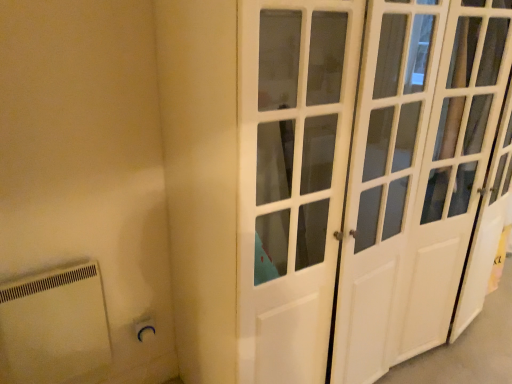
Question: From the image's perspective, is white plastic electric outlet at lower left over white glossy door at center?

Choices:
 (A) no
 (B) yes

Answer: (A)

Question: Are white plastic electric outlet at lower left and white glossy door at center located far from each other?

Choices:
 (A) no
 (B) yes

Answer: (A)

Question: Is white plastic electric outlet at lower left aimed at white glossy door at center?

Choices:
 (A) no
 (B) yes

Answer: (A)

Question: From a real-world perspective, is white plastic electric outlet at lower left below white glossy door at center?

Choices:
 (A) no
 (B) yes

Answer: (B)

Question: Can you confirm if white plastic electric outlet at lower left is thinner than white glossy door at center?

Choices:
 (A) yes
 (B) no

Answer: (A)

Question: Is point (140, 327) positioned closer to the camera than point (23, 362)?

Choices:
 (A) farther
 (B) closer

Answer: (A)

Question: Relative to white plastic radiator at lower left, is white plastic electric outlet at lower left in front or behind?

Choices:
 (A) front
 (B) behind

Answer: (B)

Question: Do you think white plastic electric outlet at lower left is within white plastic radiator at lower left, or outside of it?

Choices:
 (A) outside
 (B) inside

Answer: (B)

Question: From the image's perspective, is white plastic electric outlet at lower left above or below white plastic radiator at lower left?

Choices:
 (A) above
 (B) below

Answer: (A)

Question: In terms of width, does white plastic radiator at lower left look wider or thinner when compared to white plastic electric outlet at lower left?

Choices:
 (A) wide
 (B) thin

Answer: (A)

Question: Relative to white plastic electric outlet at lower left, is white plastic radiator at lower left in front or behind?

Choices:
 (A) front
 (B) behind

Answer: (A)

Question: From a real-world perspective, is white plastic radiator at lower left physically located above or below white plastic electric outlet at lower left?

Choices:
 (A) above
 (B) below

Answer: (A)

Question: Considering the relative positions of white plastic radiator at lower left and white plastic electric outlet at lower left in the image provided, is white plastic radiator at lower left to the left or to the right of white plastic electric outlet at lower left?

Choices:
 (A) right
 (B) left

Answer: (B)

Question: Is white plastic electric outlet at lower left to the left or to the right of white glossy door at center in the image?

Choices:
 (A) left
 (B) right

Answer: (A)

Question: Is point (153, 322) closer or farther from the camera than point (359, 291)?

Choices:
 (A) farther
 (B) closer

Answer: (A)